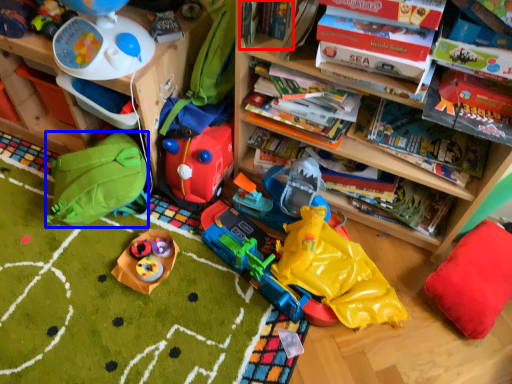
Question: Which object is closer to the camera taking this photo, book (highlighted by a red box) or backpack (highlighted by a blue box)?

Choices:
 (A) book
 (B) backpack

Answer: (A)